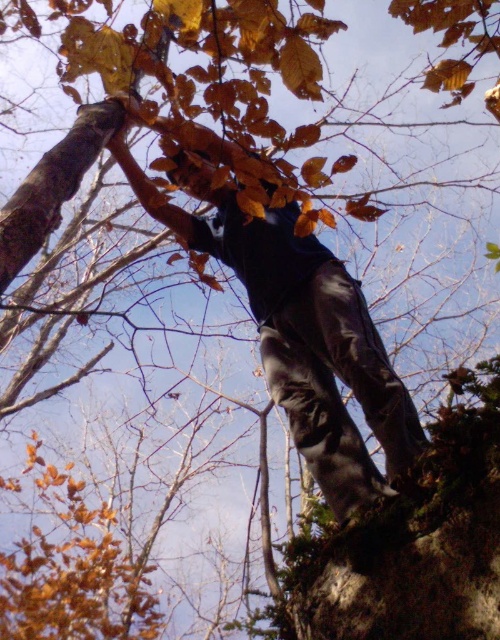
Question: Which point is closer to the camera?

Choices:
 (A) black matte pants at center
 (B) dark gray rock at lower right

Answer: (B)

Question: Is black matte pants at center positioned behind dark gray rock at lower right?

Choices:
 (A) yes
 (B) no

Answer: (A)

Question: Is black matte pants at center thinner than dark gray rock at lower right?

Choices:
 (A) no
 (B) yes

Answer: (A)

Question: Observing the image, what is the correct spatial positioning of black matte pants at center in reference to dark gray rock at lower right?

Choices:
 (A) right
 (B) left

Answer: (B)